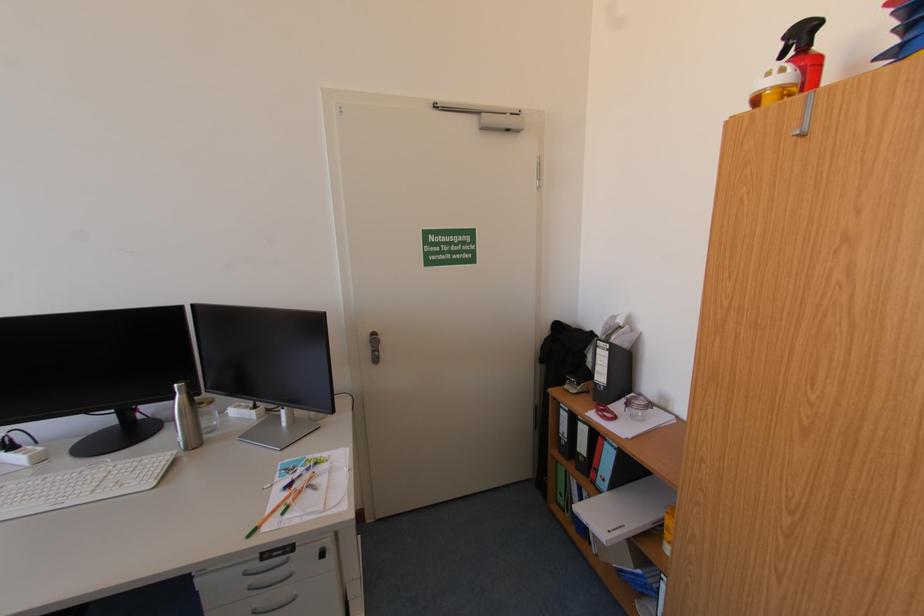
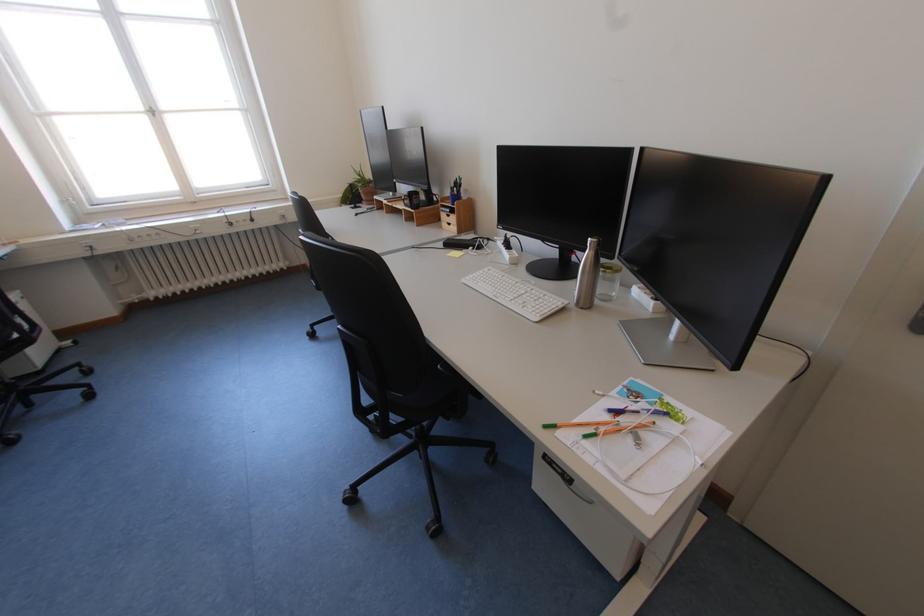
Locate, in the second image, the point that corresponds to point (185, 387) in the first image.

(599, 240)